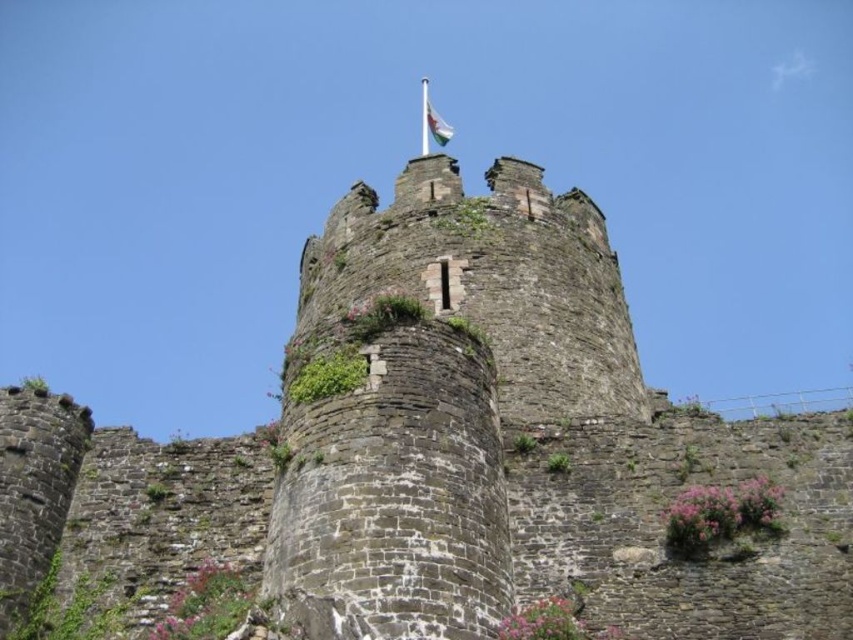
Question: Does white fabric flag at top have a greater width compared to white fabric flagpole at top?

Choices:
 (A) no
 (B) yes

Answer: (B)

Question: Can you confirm if white fabric flag at top is wider than white fabric flagpole at top?

Choices:
 (A) no
 (B) yes

Answer: (B)

Question: Which object appears closest to the camera in this image?

Choices:
 (A) white fabric flag at top
 (B) white fabric flagpole at top

Answer: (A)

Question: Among these objects, which one is nearest to the camera?

Choices:
 (A) white fabric flagpole at top
 (B) white fabric flag at top

Answer: (B)

Question: Where is white fabric flag at top located in relation to white fabric flagpole at top in the image?

Choices:
 (A) below
 (B) above

Answer: (A)

Question: Which object appears closest to the camera in this image?

Choices:
 (A) white fabric flag at top
 (B) white fabric flagpole at top

Answer: (A)